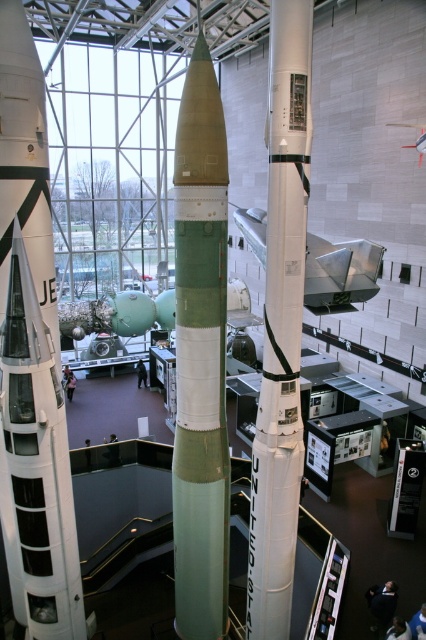
Question: Can you confirm if green matte rocket at center is thinner than metallic silver airplane at center?

Choices:
 (A) yes
 (B) no

Answer: (A)

Question: Is white matte rocket at left wider than white matte rocket at center?

Choices:
 (A) no
 (B) yes

Answer: (B)

Question: Which object is positioned farthest from the metallic silver airplane at upper right?

Choices:
 (A) white matte rocket at left
 (B) metallic silver airplane at center
 (C) green matte rocket at center

Answer: (A)

Question: Can you confirm if green matte rocket at center is positioned to the left of metallic silver airplane at center?

Choices:
 (A) no
 (B) yes

Answer: (B)

Question: Which point is closer to the camera taking this photo?

Choices:
 (A) (425, 125)
 (B) (215, 77)
 (C) (316, 266)
 (D) (0, 180)

Answer: (D)

Question: Which object is farther from the camera taking this photo?

Choices:
 (A) white matte rocket at center
 (B) metallic silver airplane at center
 (C) white matte rocket at left
 (D) metallic silver airplane at upper right

Answer: (D)